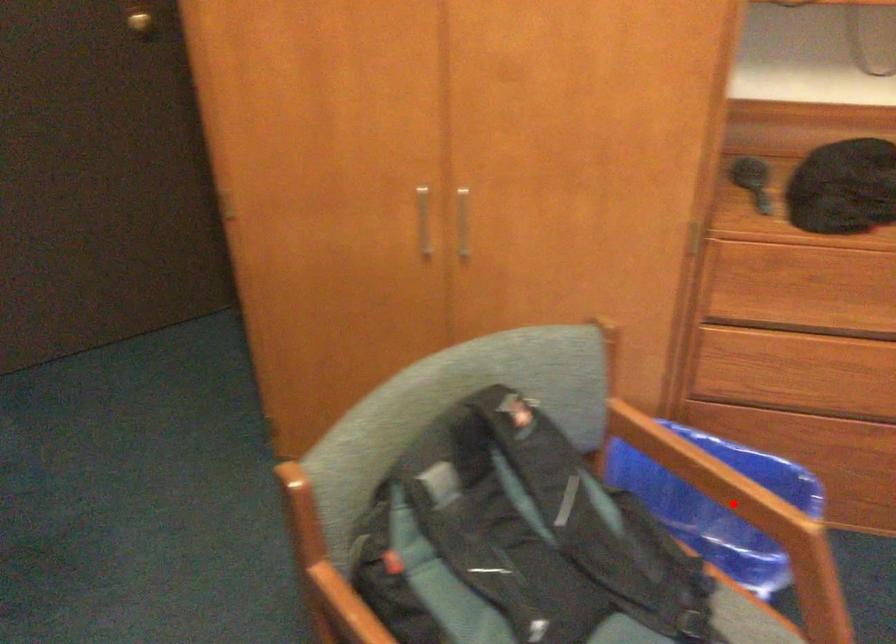
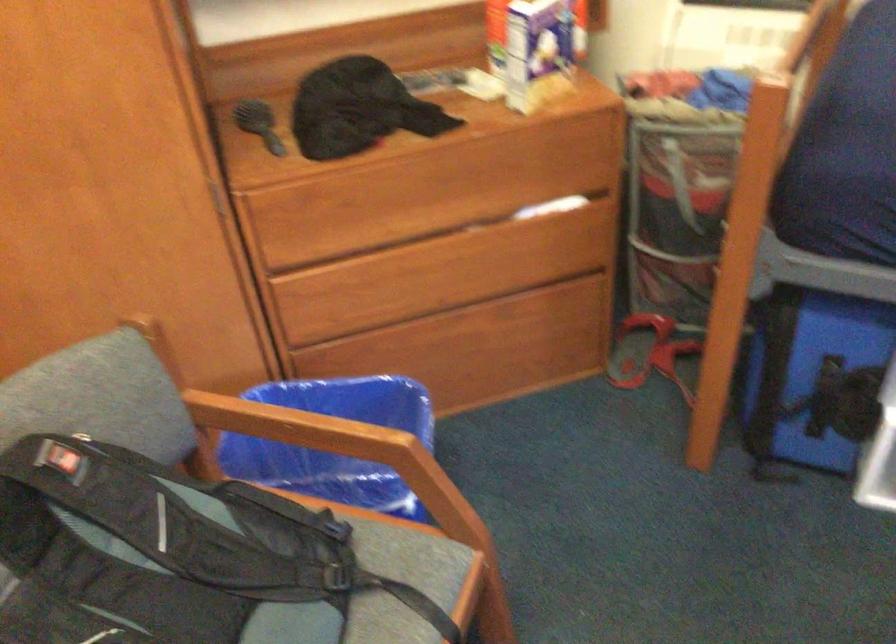
In the second image, find the point that corresponds to the highlighted location in the first image.

(334, 440)